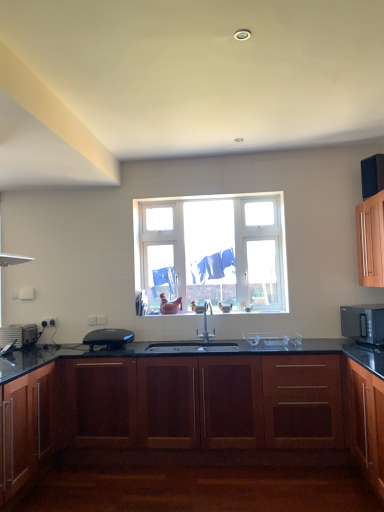
Question: Is cabinet at right, the third cabinetry from the left, looking in the opposite direction of silver metallic toaster at left, the second appliance positioned from the right?

Choices:
 (A) yes
 (B) no

Answer: (B)

Question: Is silver metallic toaster at left, which appears as the 1th appliance when viewed from the left, inside cabinet at right, the third cabinetry from the left?

Choices:
 (A) yes
 (B) no

Answer: (B)

Question: Is cabinet at right, the third cabinetry from the left, not within silver metallic toaster at left, which appears as the 1th appliance when viewed from the left?

Choices:
 (A) yes
 (B) no

Answer: (A)

Question: From a real-world perspective, is cabinet at right, acting as the first cabinetry starting from the right, on top of silver metallic toaster at left, which appears as the 1th appliance when viewed from the left?

Choices:
 (A) no
 (B) yes

Answer: (B)

Question: Can you confirm if cabinet at right, the third cabinetry from the left, is taller than silver metallic toaster at left, which appears as the 1th appliance when viewed from the left?

Choices:
 (A) no
 (B) yes

Answer: (B)

Question: Would you say black plastic toaster at center, marked as the second appliance in a left-to-right arrangement, is to the left or to the right of clear glass window at center in the picture?

Choices:
 (A) right
 (B) left

Answer: (B)

Question: Is black plastic toaster at center, marked as the second appliance in a left-to-right arrangement, situated inside clear glass window at center or outside?

Choices:
 (A) outside
 (B) inside

Answer: (A)

Question: Is black plastic toaster at center, marked as the second appliance in a left-to-right arrangement, in front of or behind clear glass window at center in the image?

Choices:
 (A) behind
 (B) front

Answer: (B)

Question: In terms of size, does black plastic toaster at center, which is the 1th appliance in right-to-left order, appear bigger or smaller than clear glass window at center?

Choices:
 (A) big
 (B) small

Answer: (B)

Question: Is mahogany wood cabinet at lower right, the 2th cabinetry viewed from the right, taller or shorter than clear glass window at center?

Choices:
 (A) tall
 (B) short

Answer: (B)

Question: From a real-world perspective, is mahogany wood cabinet at lower right, the 2th cabinetry viewed from the right, above or below clear glass window at center?

Choices:
 (A) above
 (B) below

Answer: (B)

Question: Is mahogany wood cabinet at lower right, the 2th cabinetry viewed from the right, situated inside clear glass window at center or outside?

Choices:
 (A) inside
 (B) outside

Answer: (B)

Question: From the image's perspective, is mahogany wood cabinet at lower right, the 2th cabinetry viewed from the right, above or below clear glass window at center?

Choices:
 (A) above
 (B) below

Answer: (B)

Question: Is silver metallic microwave oven at right bigger or smaller than mahogany wood cabinet at lower right, positioned as the second cabinetry in left-to-right order?

Choices:
 (A) big
 (B) small

Answer: (B)

Question: From the image's perspective, is silver metallic microwave oven at right positioned above or below mahogany wood cabinet at lower right, positioned as the second cabinetry in left-to-right order?

Choices:
 (A) below
 (B) above

Answer: (B)